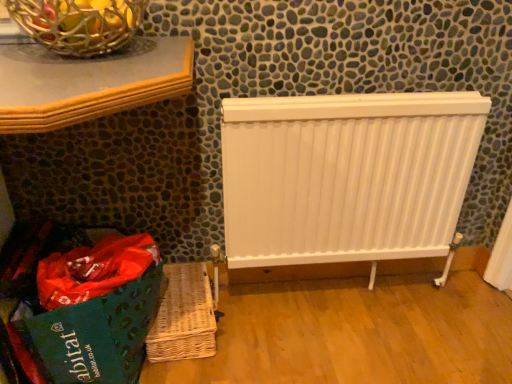
You are a GUI agent. You are given a task and a screenshot of the screen. Output one action in this format:
    pyautogui.click(x=<x>, y=<y>)
    Task: Click on the vacant space that is in between woven brown basket at lower left and white matte radiator at center
    
    Given the screenshot: What is the action you would take?
    pyautogui.click(x=302, y=313)